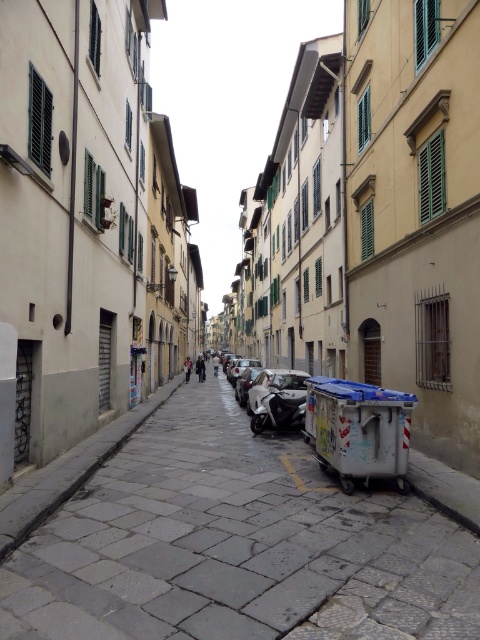
You are a delivery person with a 2.1 meter long package that needs to be transported through the narrow street. The package must be carried horizontally. Can you safely carry it between the gray stone pavement at center and the shiny silver motorcycle at center without touching either?

The distance between the gray stone pavement at center and the shiny silver motorcycle at center is 2.44 meters. Since the package is 2.1 meters long, there is enough space to carry it horizontally between them without touching either object.

You are driving a shiny silver car at center on a narrow street with gray stone pavement at center. Can you safely pass through the street without hitting the pavement?

The gray stone pavement at center is located above the shiny silver car at center, so the car can safely pass underneath it without hitting the pavement.